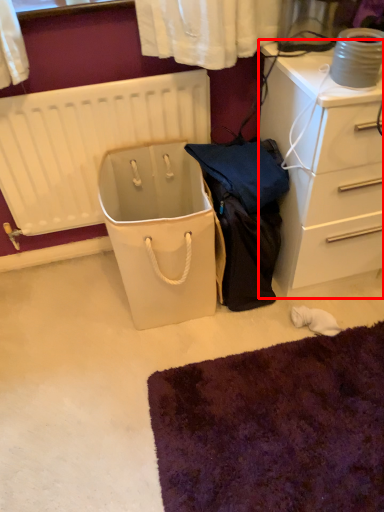
Question: From the image's perspective, what is the correct spatial relationship of chest of drawers (annotated by the red box) in relation to radiator?

Choices:
 (A) above
 (B) below

Answer: (A)